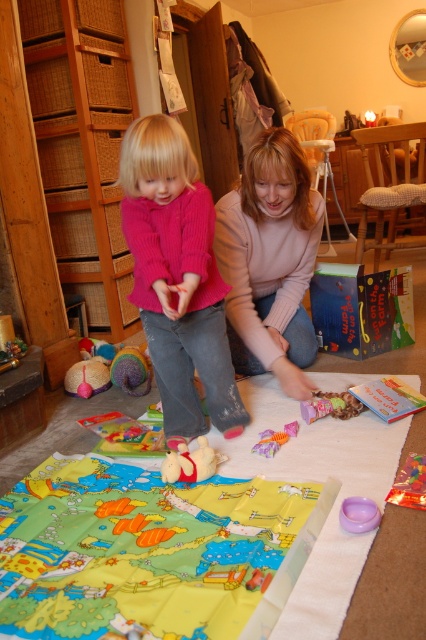
This screenshot has height=640, width=426. I want to click on fluffy plush toy at center, so click(x=190, y=461).

Between fluffy plush toy at center and purple plastic bowl at lower center, which one has less height?

Standing shorter between the two is purple plastic bowl at lower center.

Identify the location of fluffy plush toy at center. (190, 461).

This screenshot has width=426, height=640. Find the location of `fluffy plush toy at center`. fluffy plush toy at center is located at coordinates (190, 461).

Measure the distance between matte pink sweater at center and wooden toy at center.

matte pink sweater at center is 18.10 inches from wooden toy at center.

Which is in front, point (222, 253) or point (356, 408)?

Point (356, 408) is in front.

Measure the distance between matte pink sweater at center and camera.

matte pink sweater at center is 1.81 meters away from camera.

Locate an element on the screen. This screenshot has height=640, width=426. matte pink sweater at center is located at coordinates (270, 260).

Does knitted pink sweater at center have a greater width compared to plush orange and purple toy at center?

Yes, knitted pink sweater at center is wider than plush orange and purple toy at center.

Based on the photo, how distant is knitted pink sweater at center from plush orange and purple toy at center?

A distance of 19.32 inches exists between knitted pink sweater at center and plush orange and purple toy at center.

Between point (138, 227) and point (288, 428), which one is positioned behind?

The point (288, 428) is more distant.

The image size is (426, 640). Find the location of `knitted pink sweater at center`. knitted pink sweater at center is located at coordinates (178, 276).